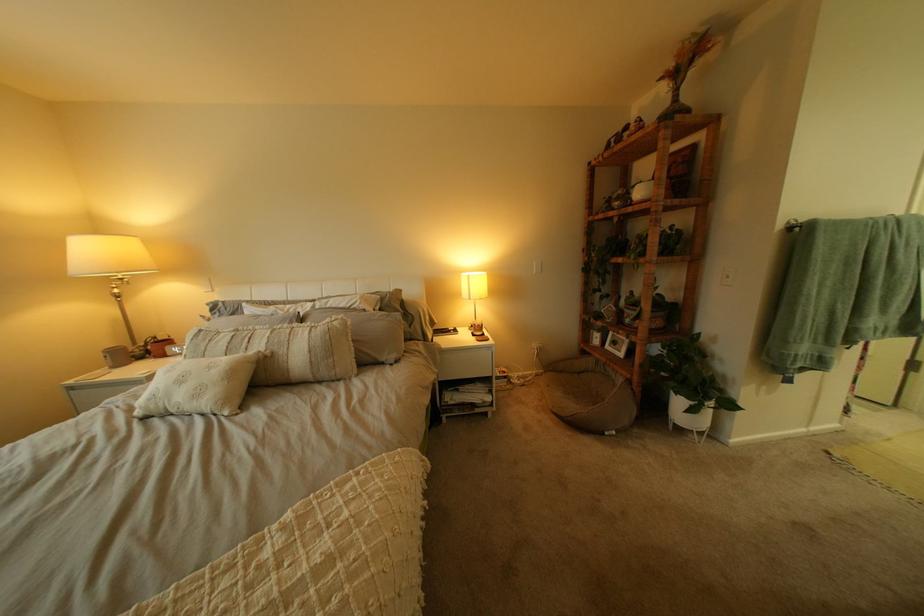
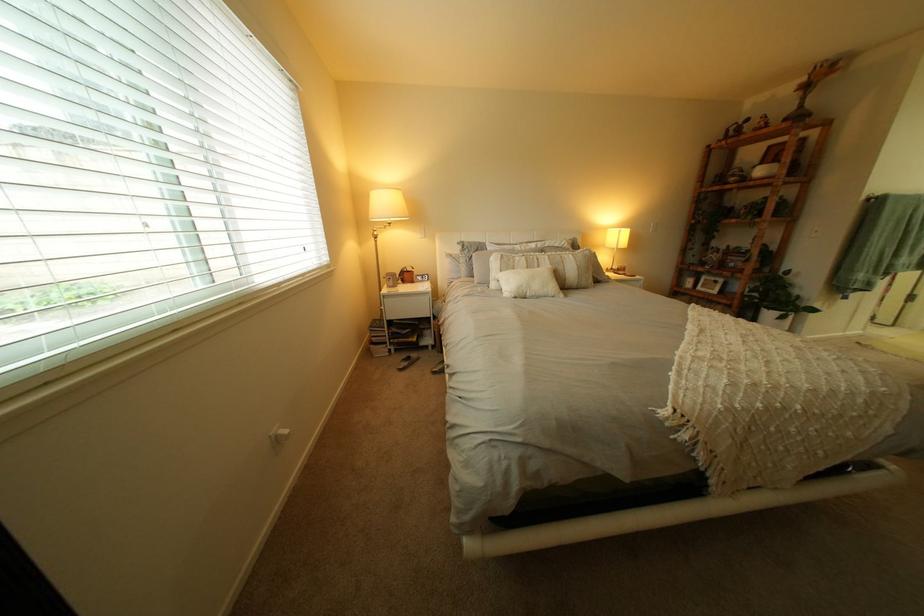
In a continuous first-person perspective shot, in which direction is the camera moving?

The cameraman moved toward left, backward.